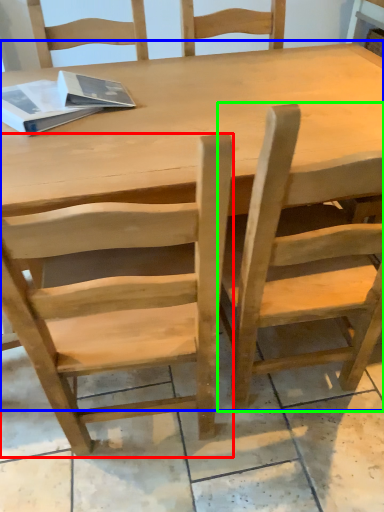
Question: Estimate the real-world distances between objects in this image. Which object is closer to chair (highlighted by a red box), table (highlighted by a blue box) or chair (highlighted by a green box)?

Choices:
 (A) table
 (B) chair

Answer: (B)